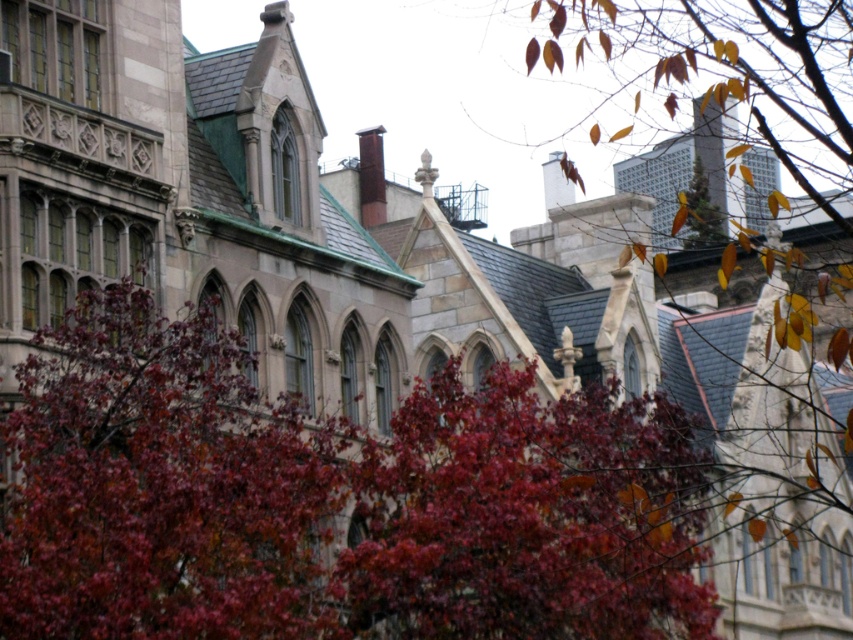
Which of these two, shiny red leaves at center or autumn leaves at upper right, stands shorter?

autumn leaves at upper right

Is shiny red leaves at center further to the viewer compared to autumn leaves at upper right?

No.

Is point (373, 552) positioned behind point (695, 212)?

No, it is in front of (695, 212).

Identify the location of shiny red leaves at center. (527, 516).

Is leaves matte at center thinner than shiny red leaves at center?

Correct, leaves matte at center's width is less than shiny red leaves at center's.

Based on the photo, is leaves matte at center to the right of shiny red leaves at center from the viewer's perspective?

Incorrect, leaves matte at center is not on the right side of shiny red leaves at center.

Is point (235, 394) behind point (560, 420)?

No, (235, 394) is in front of (560, 420).

Locate an element on the screen. Image resolution: width=853 pixels, height=640 pixels. leaves matte at center is located at coordinates (161, 484).

Is point (235, 371) positioned after point (701, 212)?

No.

Is leaves matte at center above autumn leaves at upper right?

Actually, leaves matte at center is below autumn leaves at upper right.

Who is more distant from viewer, (x=265, y=474) or (x=723, y=230)?

The point (x=723, y=230) is behind.

You are a GUI agent. You are given a task and a screenshot of the screen. Output one action in this format:
    pyautogui.click(x=<x>, y=<y>)
    Task: Click on the leaves matte at center
    
    Given the screenshot: What is the action you would take?
    pyautogui.click(x=161, y=484)